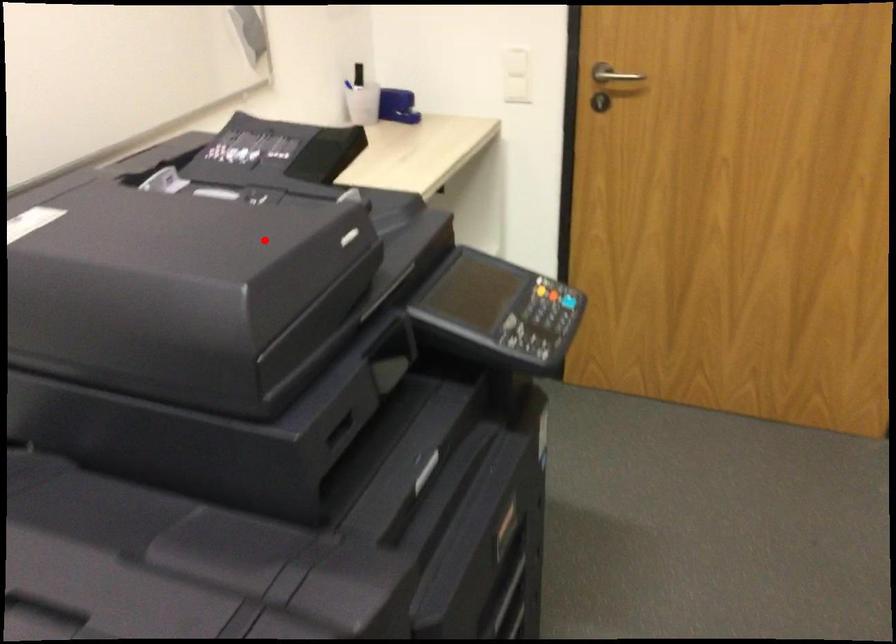
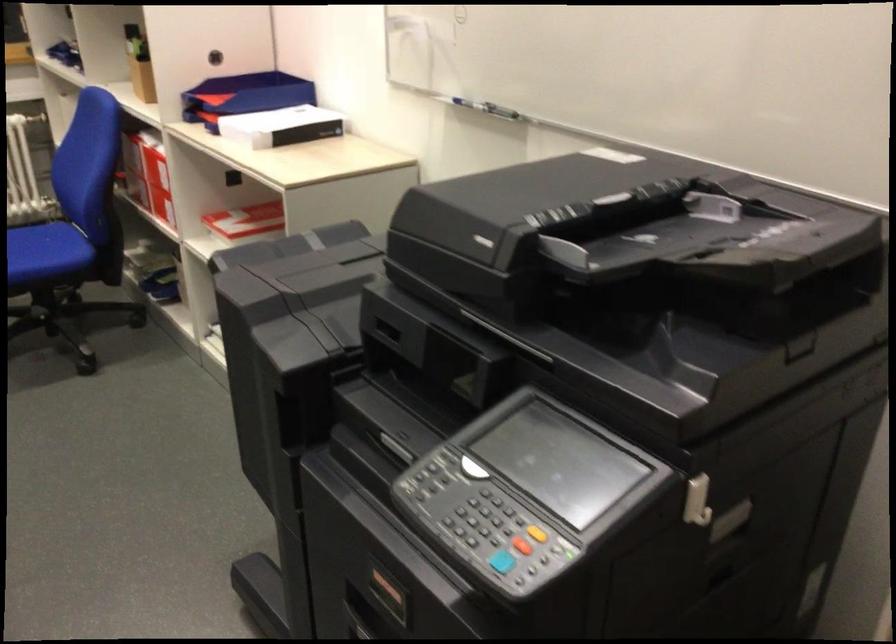
Question: A red point is marked in image1. In image2, is the corresponding 3D point closer to the camera or farther? Reply with the corresponding letter.

Choices:
 (A) The corresponding 3D point is closer.
 (B) The corresponding 3D point is farther.

Answer: (B)